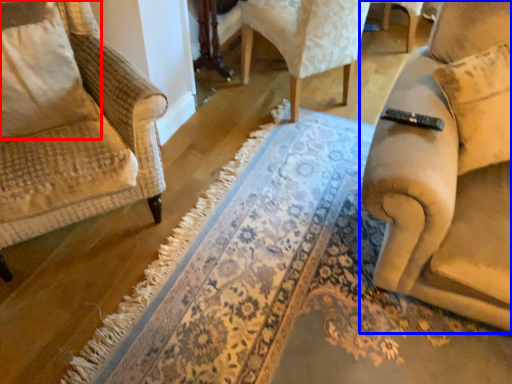
Question: Among these objects, which one is nearest to the camera, pillow (highlighted by a red box) or chair (highlighted by a blue box)?

Choices:
 (A) pillow
 (B) chair

Answer: (B)